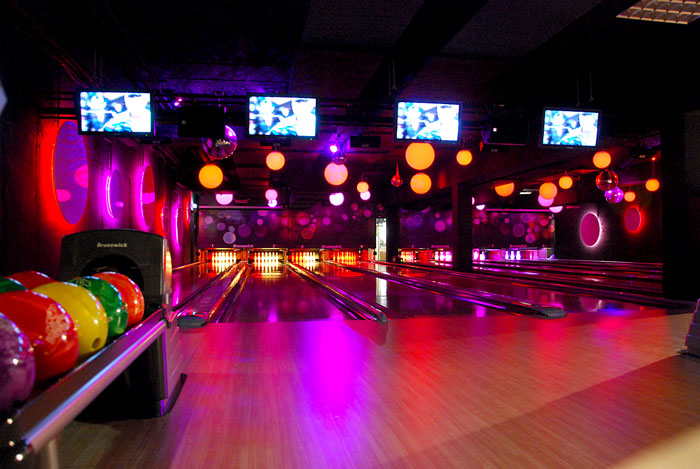
You are a GUI agent. You are given a task and a screenshot of the screen. Output one action in this format:
    pyautogui.click(x=<x>, y=<y>)
    Task: Click on the tvs
    This screenshot has height=469, width=700.
    Given the screenshot: What is the action you would take?
    pyautogui.click(x=130, y=107), pyautogui.click(x=266, y=117), pyautogui.click(x=460, y=132), pyautogui.click(x=568, y=139)